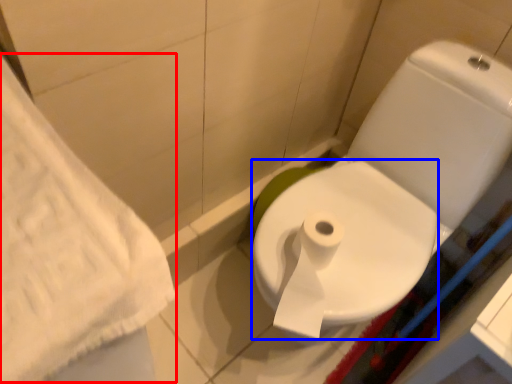
Question: Which object appears closest to the camera in this image, bath towel (highlighted by a red box) or bidet (highlighted by a blue box)?

Choices:
 (A) bath towel
 (B) bidet

Answer: (A)